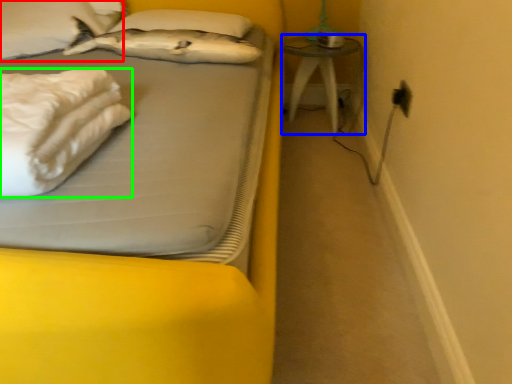
Question: Which object is positioned closest to pillow (highlighted by a red box)? Select from table (highlighted by a blue box) and material (highlighted by a green box).

Choices:
 (A) table
 (B) material

Answer: (B)